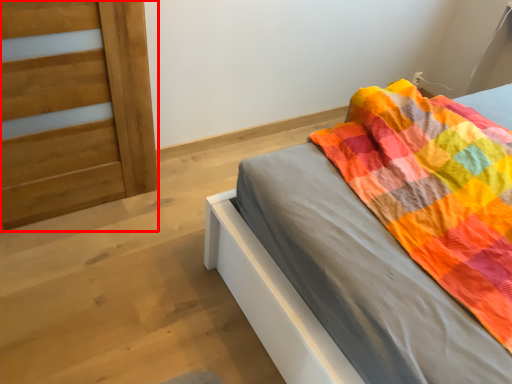
Question: From the image's perspective, considering the relative positions of door (annotated by the red box) and bed in the image provided, where is door (annotated by the red box) located with respect to the staircase?

Choices:
 (A) above
 (B) below

Answer: (A)